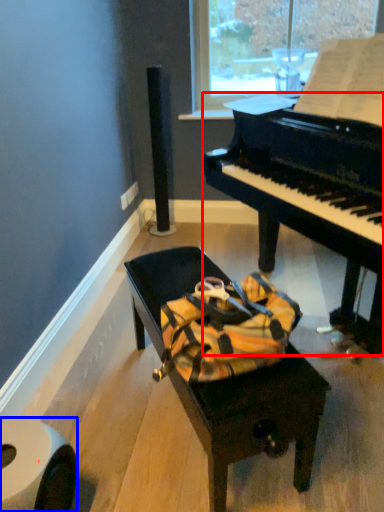
Question: Among these objects, which one is nearest to the camera, piano (highlighted by a red box) or toilet paper (highlighted by a blue box)?

Choices:
 (A) piano
 (B) toilet paper

Answer: (A)